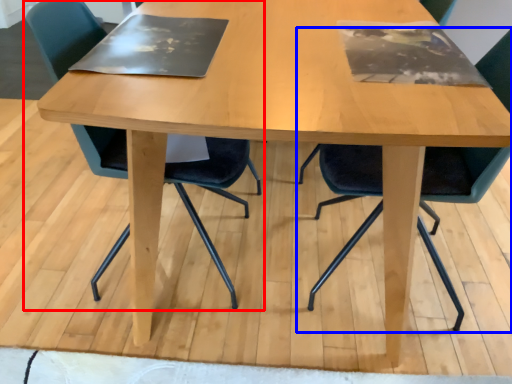
Question: Which point is closer to the camera, chair (highlighted by a red box) or chair (highlighted by a blue box)?

Choices:
 (A) chair
 (B) chair

Answer: (B)